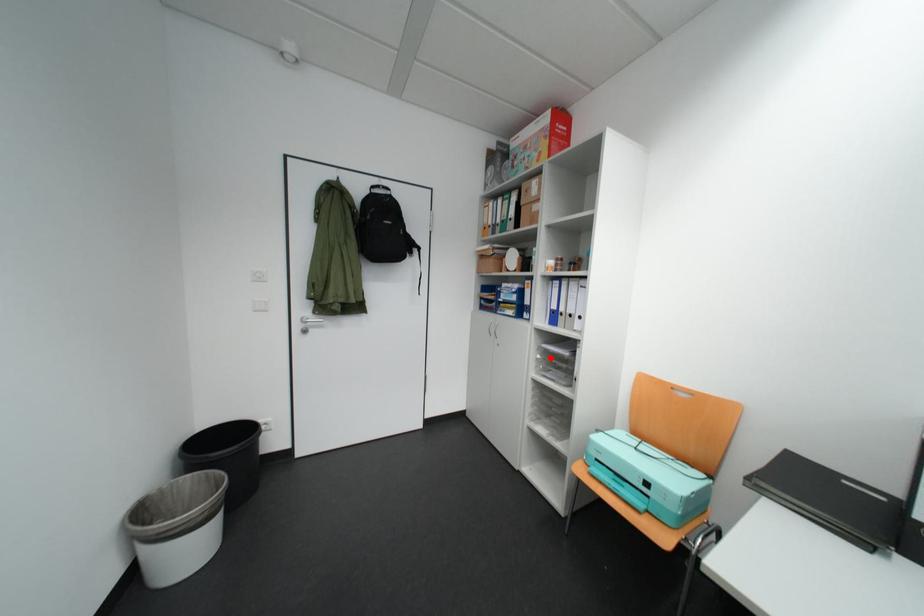
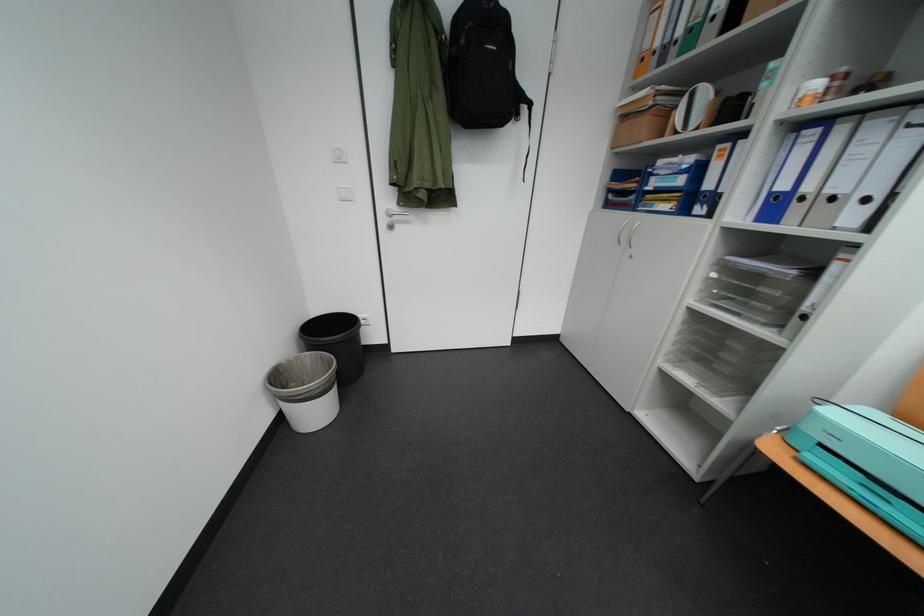
Where in the second image is the point corresponding to the highlighted location from the first image?

(724, 277)